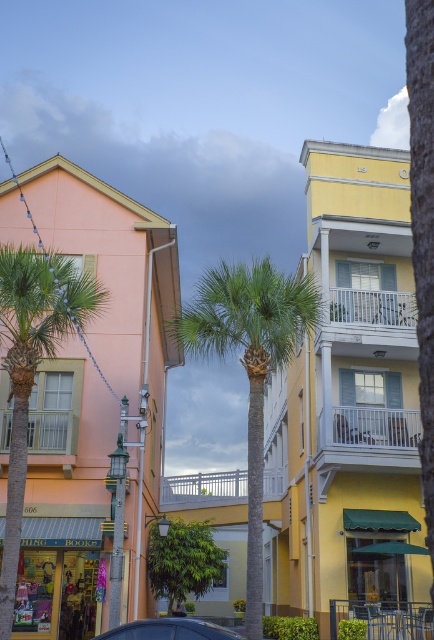
Based on the scene description, where is the green leafy palm tree at center located in terms of coordinates?

The green leafy palm tree at center is located at point coordinates of (x=249, y=365).